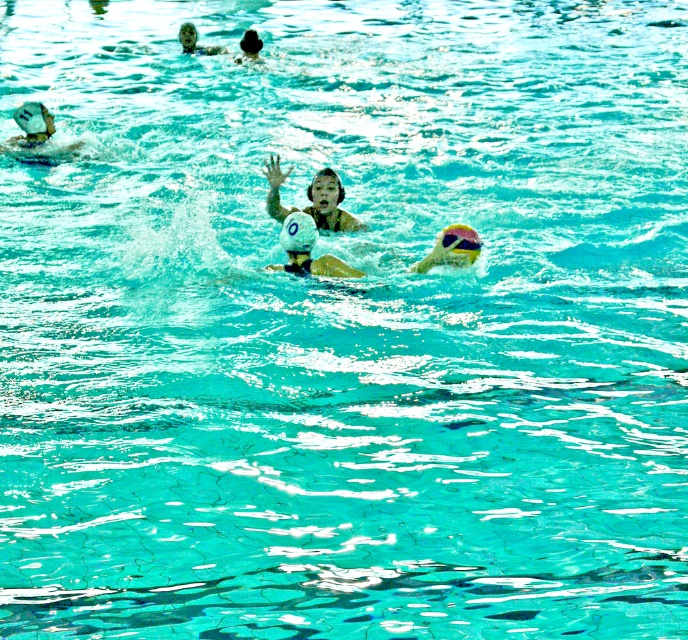
Question: Is smooth white swimmer at center below white matte swim cap at upper left?

Choices:
 (A) no
 (B) yes

Answer: (B)

Question: Which point is closer to the camera?

Choices:
 (A) (252, 60)
 (B) (43, 129)
 (C) (279, 177)
 (D) (433, 260)

Answer: (D)

Question: Does white matte swim cap at upper left appear over smooth skin face at upper center?

Choices:
 (A) no
 (B) yes

Answer: (A)

Question: Which object is positioned farthest from the smooth white swimmer at center?

Choices:
 (A) yellow rubber ball at center
 (B) smooth skin face at upper center
 (C) white matte water polo ball at center

Answer: (B)

Question: Estimate the real-world distances between objects in this image. Which object is closer to the smooth skin face at upper center?

Choices:
 (A) smooth white swimmer at center
 (B) white matte water polo ball at center

Answer: (A)

Question: Does yellow rubber ball at center appear under smooth skin face at upper center?

Choices:
 (A) no
 (B) yes

Answer: (B)